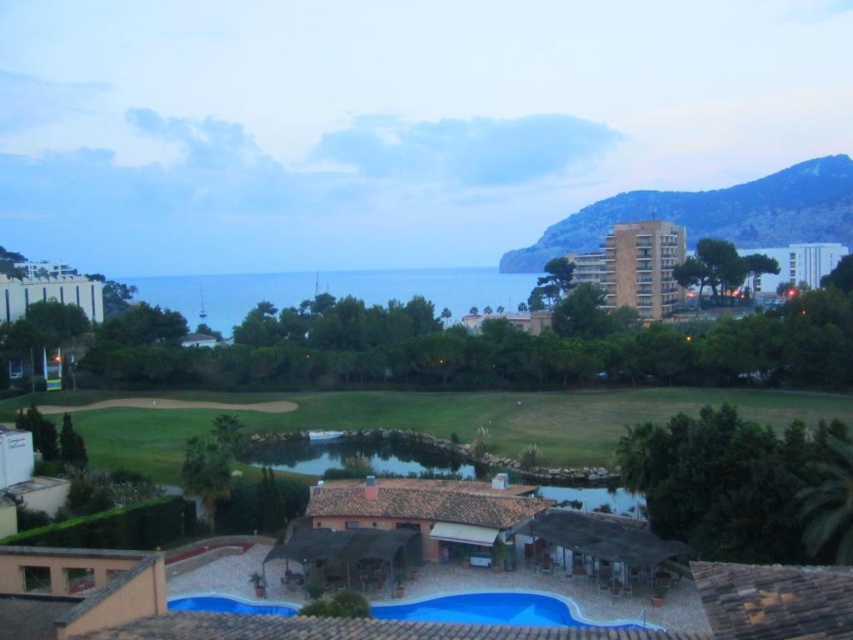
Is beige concrete building at upper right closer to the viewer compared to blue glossy pool at lower center?

No.

Between beige concrete building at upper right and blue glossy pool at lower center, which one is positioned higher?

Positioned higher is beige concrete building at upper right.

Is point (619, 285) closer to camera compared to point (178, 602)?

No, it is behind (178, 602).

Identify the location of beige concrete building at upper right. (636, 266).

Can you confirm if beige concrete building at upper right is thinner than white glossy building at left?

Correct, beige concrete building at upper right's width is less than white glossy building at left's.

Is point (657, 310) behind point (97, 296)?

No.

Which is behind, point (656, 232) or point (24, 284)?

Point (656, 232)

The width and height of the screenshot is (853, 640). I want to click on beige concrete building at upper right, so click(636, 266).

Is green grass at center thinner than blue glossy pool at lower center?

Incorrect, green grass at center's width is not less than blue glossy pool at lower center's.

The width and height of the screenshot is (853, 640). What do you see at coordinates (335, 291) in the screenshot? I see `green grass at center` at bounding box center [335, 291].

What do you see at coordinates (335, 291) in the screenshot? I see `green grass at center` at bounding box center [335, 291].

This screenshot has height=640, width=853. In order to click on green grass at center in this screenshot , I will do `click(335, 291)`.